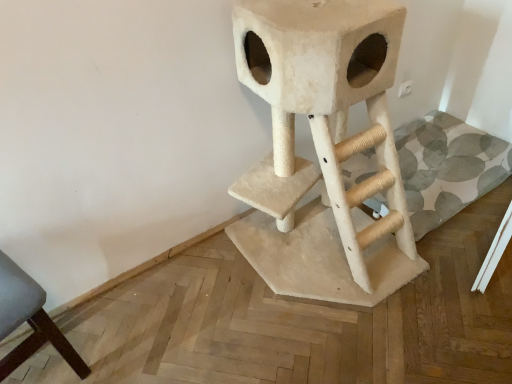
This screenshot has width=512, height=384. I want to click on vacant space in front of beige carpeted cat tree at center, so [354, 345].